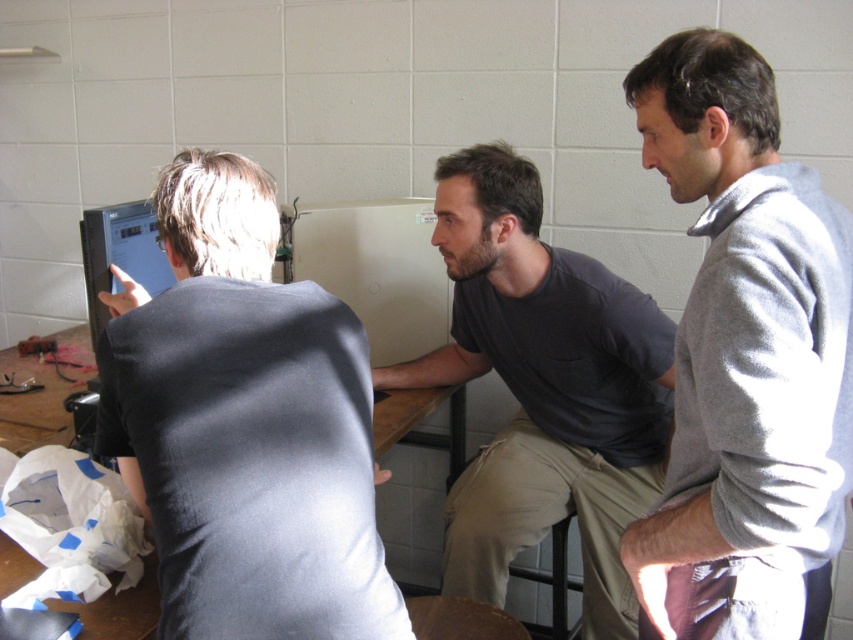
You are organizing a clothing donation drive and have two items to compare for size compatibility. You have a gray sweater at upper right and a dark gray shirt at center. Which item is smaller in size?

The gray sweater at upper right is smaller in size compared to the dark gray shirt at center according to the description.

You are a fashion designer observing the image. You need to determine which item of clothing is shorter between the gray sweater at upper right and the dark gray shirt at center. Which one should you choose?

The gray sweater at upper right is shorter than the dark gray shirt at center, so you should choose the gray sweater at upper right.